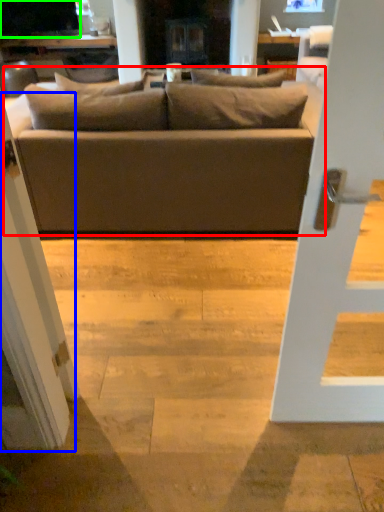
Question: Which is nearer to the studio couch (highlighted by a red box)? screen door (highlighted by a blue box) or dark (highlighted by a green box).

Choices:
 (A) screen door
 (B) dark

Answer: (A)